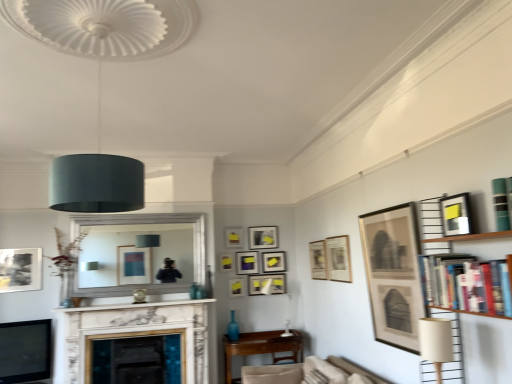
Question: In terms of height, does matte yellow picture frame at upper center, the ninth picture frame positioned from the right, look taller or shorter compared to matte black picture frame at center, positioned as the 4th picture frame in back-to-front order?

Choices:
 (A) short
 (B) tall

Answer: (A)

Question: Is matte yellow picture frame at upper center, the ninth picture frame positioned from the right, inside the boundaries of matte black picture frame at center, which is the 9th picture frame in front-to-back order, or outside?

Choices:
 (A) inside
 (B) outside

Answer: (B)

Question: Which object is positioned farthest from the matte black picture frame at upper center, which is the 8th picture frame from left to right?

Choices:
 (A) white marble fireplace at center
 (B) matte black picture frame at upper center, which is the twelfth picture frame from front to back
 (C) white marble fireplace at center
 (D) matte white picture frame at upper center, which is the eighth picture frame from front to back
 (E) wooden table at center

Answer: (A)

Question: Estimate the real-world distances between objects in this image. Which object is farther from the matte black picture frame at upper center, which is the 9th picture frame in back-to-front order?

Choices:
 (A) matte black picture frame at upper right, positioned as the 3th picture frame in right-to-left order
 (B) matte black picture frame at upper center, which is the twelfth picture frame from front to back
 (C) matte black picture frame at upper right, acting as the first picture frame starting from the right
 (D) teal matte bookshelf at upper right
 (E) matte beige lampshade at lower right, which is counted as the 1th lamp, starting from the bottom

Answer: (D)